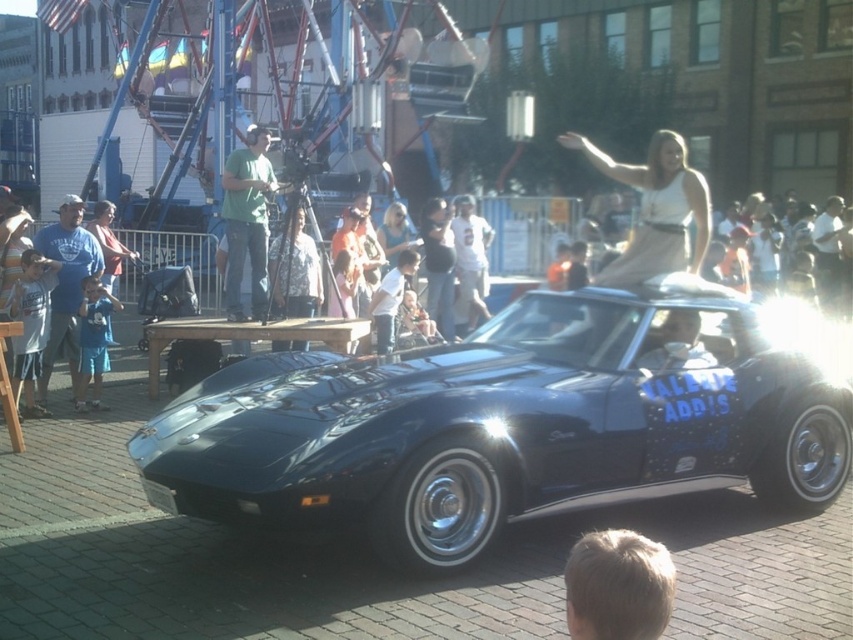
Question: Estimate the real-world distances between objects in this image. Which object is closer to the blue cotton shirt at lower left?

Choices:
 (A) green matte shirt at center
 (B) glossy black car at center

Answer: (A)

Question: Is glossy black car at center positioned at the back of blue cotton shirt at lower left?

Choices:
 (A) yes
 (B) no

Answer: (B)

Question: Which point appears farthest from the camera in this image?

Choices:
 (A) (750, 448)
 (B) (247, 234)

Answer: (B)

Question: Can you confirm if glossy black car at center is positioned below green matte shirt at center?

Choices:
 (A) yes
 (B) no

Answer: (A)

Question: Does green matte shirt at center appear on the right side of blue cotton shirt at lower left?

Choices:
 (A) no
 (B) yes

Answer: (B)

Question: Which of the following is the farthest from the observer?

Choices:
 (A) (91, 276)
 (B) (259, 248)
 (C) (759, 481)

Answer: (B)